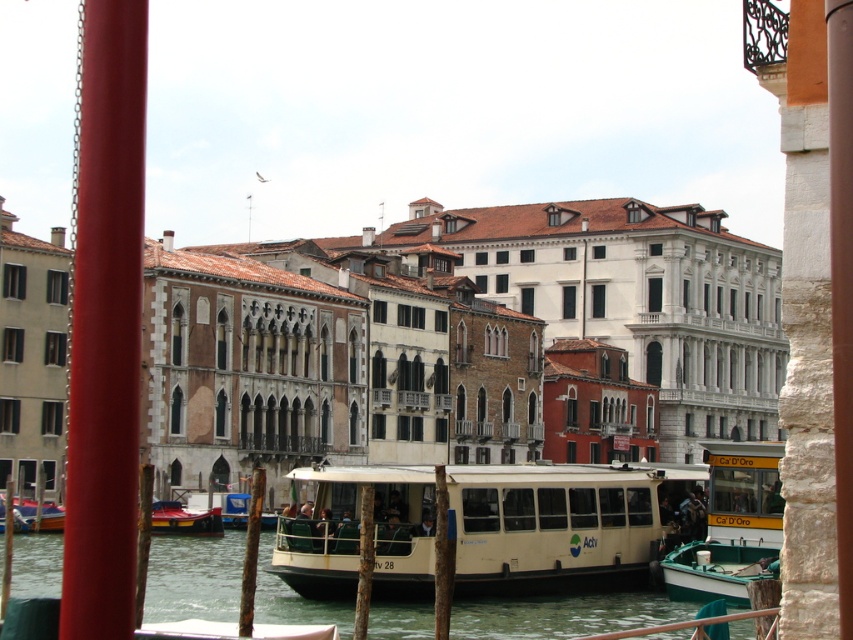
Question: Does beige rubber boat at center appear on the right side of metallic red boat at lower left?

Choices:
 (A) no
 (B) yes

Answer: (B)

Question: Estimate the real-world distances between objects in this image. Which object is closer to the green painted wood boat at lower right?

Choices:
 (A) beige rubber boat at center
 (B) metallic red boat at lower left
 (C) wooden boat at lower left
 (D) green water at center

Answer: (A)

Question: Is the position of green painted wood boat at lower right less distant than that of metallic red boat at lower left?

Choices:
 (A) no
 (B) yes

Answer: (B)

Question: Is beige rubber boat at center to the left of wooden boat at lower left from the viewer's perspective?

Choices:
 (A) yes
 (B) no

Answer: (B)

Question: Which point appears farthest from the camera in this image?

Choices:
 (A) (758, 488)
 (B) (616, 616)

Answer: (A)

Question: Considering the real-world distances, which object is farthest from the wooden boat at lower left?

Choices:
 (A) metallic red boat at lower left
 (B) beige rubber boat at center

Answer: (B)